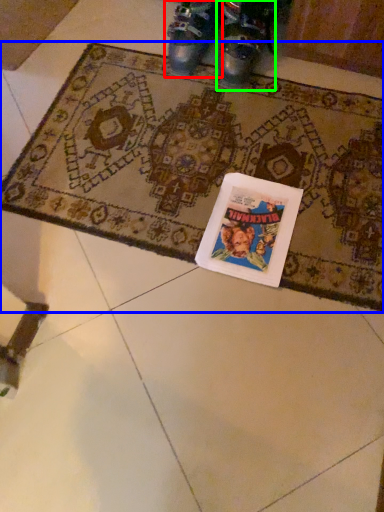
Question: Considering the real-world distances, which object is farthest from footwear (highlighted by a red box)? mat (highlighted by a blue box) or footwear (highlighted by a green box)?

Choices:
 (A) mat
 (B) footwear

Answer: (A)